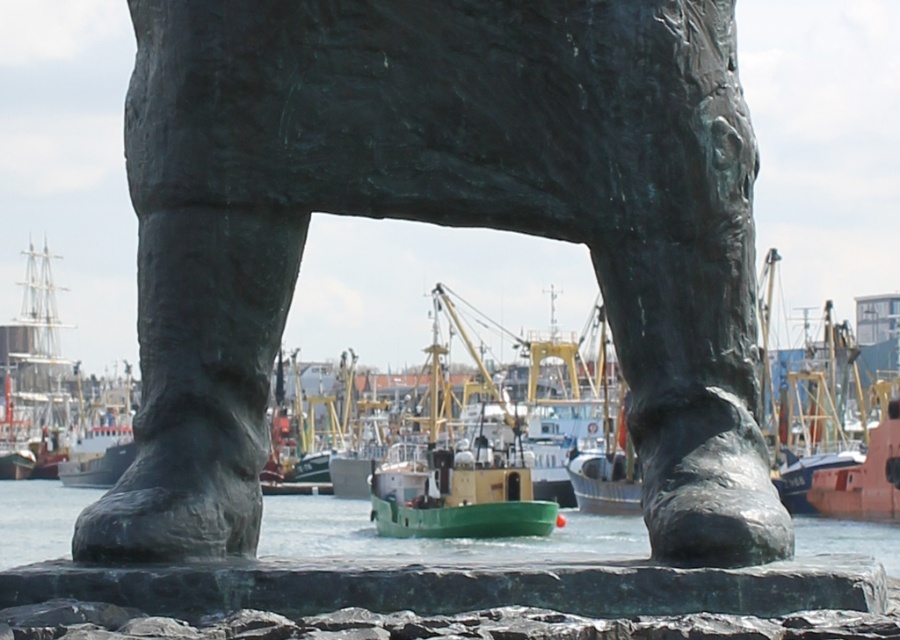
Who is more distant from viewer, (x=169, y=561) or (x=495, y=516)?

The point (x=495, y=516) is more distant.

Measure the distance from bronze statue at center to green matte boat at center.

bronze statue at center is 119.90 meters from green matte boat at center.

Which is behind, point (267, 16) or point (432, 392)?

The point (432, 392) is behind.

The image size is (900, 640). In order to click on bronze statue at center in this screenshot , I will do `click(438, 224)`.

Which is above, green matte water at center or green matte boat at center?

green matte boat at center

Who is more distant from viewer, (416, 557) or (501, 477)?

The point (501, 477) is more distant.

Where is `green matte water at center`? The image size is (900, 640). green matte water at center is located at coordinates (432, 540).

Can you confirm if bronze statue at center is thinner than green matte water at center?

Correct, bronze statue at center's width is less than green matte water at center's.

Describe the element at coordinates (438, 224) in the screenshot. I see `bronze statue at center` at that location.

In order to click on bronze statue at center in this screenshot , I will do `click(438, 224)`.